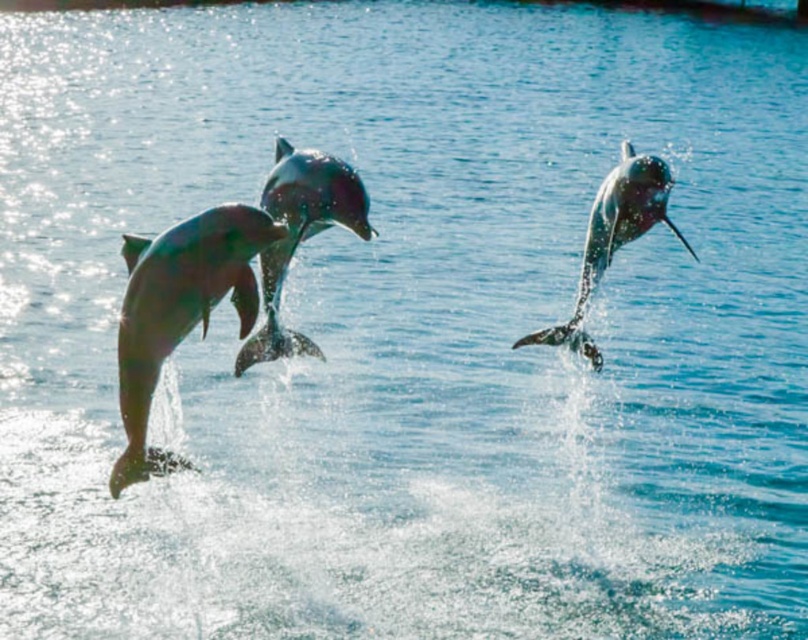
You are a photographer trying to capture the dolphin at the center. You notice another dolphin in the background. Which dolphin is closer to the camera, the shiny silver dolphin at center or the shiny silver dolphin at upper right?

The shiny silver dolphin at center is closer to the camera because it is in front of the shiny silver dolphin at upper right.

You are a marine biologist observing the dolphins and need to track their positions. According to the coordinates provided, where is the shiny metallic dolphin at left positioned?

The shiny metallic dolphin at left is located at point (179, 308).